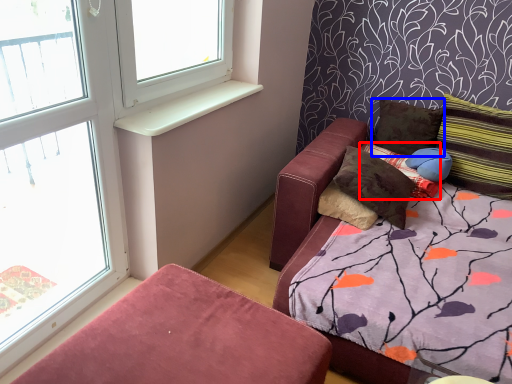
Question: Which of the following is the closest to the observer, pillow (highlighted by a red box) or pillow (highlighted by a blue box)?

Choices:
 (A) pillow
 (B) pillow

Answer: (A)